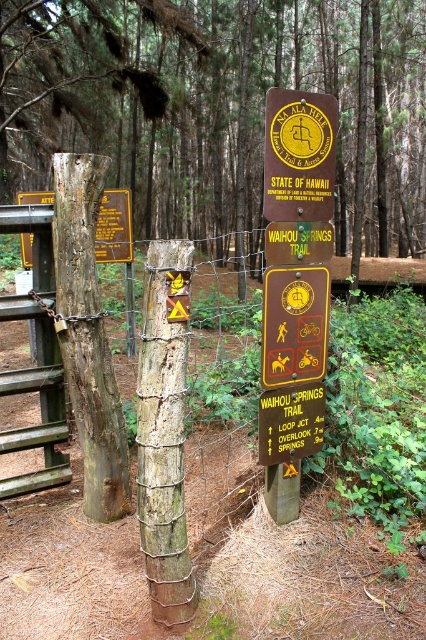
Question: Among these points, which one is farthest from the camera?

Choices:
 (A) (279, 0)
 (B) (262, 460)
 (C) (170, 369)
 (D) (288, 97)

Answer: (A)

Question: Among these objects, which one is nearest to the camera?

Choices:
 (A) brown rough wood at center
 (B) weathered wood sign at center
 (C) yellow matte sign at center

Answer: (B)

Question: Which point is farther to the camera?

Choices:
 (A) yellowmaterial/texturewarning sign at upper center
 (B) brown rough wood at center
 (C) yellow matte sign at center
 (D) weathered wood sign at center

Answer: (B)

Question: Is yellow matte sign at center closer to camera compared to yellow plastic warning sign at center?

Choices:
 (A) no
 (B) yes

Answer: (B)

Question: Does yellow matte sign at center have a lesser width compared to yellowmaterial/texturewarning sign at upper center?

Choices:
 (A) no
 (B) yes

Answer: (A)

Question: Is brown rough wood at center to the left of yellowmaterial/texturewarning sign at center from the viewer's perspective?

Choices:
 (A) no
 (B) yes

Answer: (A)